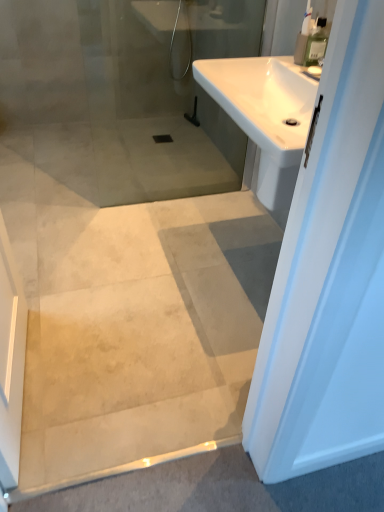
What do you see at coordinates (265, 114) in the screenshot?
I see `white glossy sink at upper right` at bounding box center [265, 114].

The width and height of the screenshot is (384, 512). Find the location of `white glossy sink at upper right`. white glossy sink at upper right is located at coordinates (265, 114).

What do you see at coordinates (316, 42) in the screenshot? This screenshot has width=384, height=512. I see `clear plastic bottle at upper right` at bounding box center [316, 42].

Image resolution: width=384 pixels, height=512 pixels. In order to click on clear plastic bottle at upper right in this screenshot , I will do `click(316, 42)`.

I want to click on white glossy sink at upper right, so click(265, 114).

Considering the relative positions of white glossy sink at upper right and clear plastic bottle at upper right in the image provided, is white glossy sink at upper right to the left of clear plastic bottle at upper right from the viewer's perspective?

Yes.

Which object is closer to the camera, white glossy sink at upper right or clear plastic bottle at upper right?

white glossy sink at upper right.

Which is behind, point (276, 157) or point (323, 48)?

The point (323, 48) is behind.

From the image's perspective, relative to clear plastic bottle at upper right, is white glossy sink at upper right above or below?

white glossy sink at upper right is below clear plastic bottle at upper right.

From a real-world perspective, is white glossy sink at upper right positioned under clear plastic bottle at upper right based on gravity?

Yes.

Which of these two, white glossy sink at upper right or clear plastic bottle at upper right, is wider?

white glossy sink at upper right is wider.

Does white glossy sink at upper right have a greater height compared to clear plastic bottle at upper right?

No, white glossy sink at upper right is not taller than clear plastic bottle at upper right.

Considering the relative sizes of white glossy sink at upper right and clear plastic bottle at upper right in the image provided, is white glossy sink at upper right smaller than clear plastic bottle at upper right?

No.

Which is correct: white glossy sink at upper right is inside clear plastic bottle at upper right, or outside of it?

white glossy sink at upper right exists outside the volume of clear plastic bottle at upper right.

Is white glossy sink at upper right next to clear plastic bottle at upper right and touching it?

They are not placed beside each other.

Is white glossy sink at upper right oriented towards clear plastic bottle at upper right?

No, white glossy sink at upper right does not turn towards clear plastic bottle at upper right.

What's the angular difference between white glossy sink at upper right and clear plastic bottle at upper right's facing directions?

0.904 degrees separate the facing orientations of white glossy sink at upper right and clear plastic bottle at upper right.

The height and width of the screenshot is (512, 384). I want to click on sink that is on the left side of clear plastic bottle at upper right, so click(x=265, y=114).

Does clear plastic bottle at upper right appear on the right side of white glossy sink at upper right?

Indeed, clear plastic bottle at upper right is positioned on the right side of white glossy sink at upper right.

Is clear plastic bottle at upper right in front of or behind white glossy sink at upper right in the image?

clear plastic bottle at upper right is positioned farther from the viewer than white glossy sink at upper right.

Considering the points (308, 53) and (278, 89), which point is behind, point (308, 53) or point (278, 89)?

The point (278, 89) is more distant.

From the image's perspective, relative to white glossy sink at upper right, is clear plastic bottle at upper right above or below?

From the image's perspective, clear plastic bottle at upper right appears above white glossy sink at upper right.

From a real-world perspective, which object stands above the other?

clear plastic bottle at upper right is physically above.

Considering the relative sizes of clear plastic bottle at upper right and white glossy sink at upper right in the image provided, is clear plastic bottle at upper right wider than white glossy sink at upper right?

In fact, clear plastic bottle at upper right might be narrower than white glossy sink at upper right.

Considering the relative sizes of clear plastic bottle at upper right and white glossy sink at upper right in the image provided, is clear plastic bottle at upper right taller than white glossy sink at upper right?

Correct, clear plastic bottle at upper right is much taller as white glossy sink at upper right.

Between clear plastic bottle at upper right and white glossy sink at upper right, which one has larger size?

Bigger between the two is white glossy sink at upper right.

Could white glossy sink at upper right be considered to be inside clear plastic bottle at upper right?

That's incorrect, white glossy sink at upper right is not inside clear plastic bottle at upper right.

Would you consider clear plastic bottle at upper right to be distant from white glossy sink at upper right?

No, clear plastic bottle at upper right is not far away from white glossy sink at upper right.

Is clear plastic bottle at upper right aimed at white glossy sink at upper right?

No, clear plastic bottle at upper right does not turn towards white glossy sink at upper right.

Image resolution: width=384 pixels, height=512 pixels. Find the location of `toiletry located above the white glossy sink at upper right (from the image's perspective)`. toiletry located above the white glossy sink at upper right (from the image's perspective) is located at coordinates (316, 42).

What are the coordinates of `toiletry above the white glossy sink at upper right (from the image's perspective)` in the screenshot? It's located at (316, 42).

Find the location of `toiletry on the right side of white glossy sink at upper right`. toiletry on the right side of white glossy sink at upper right is located at coordinates (316, 42).